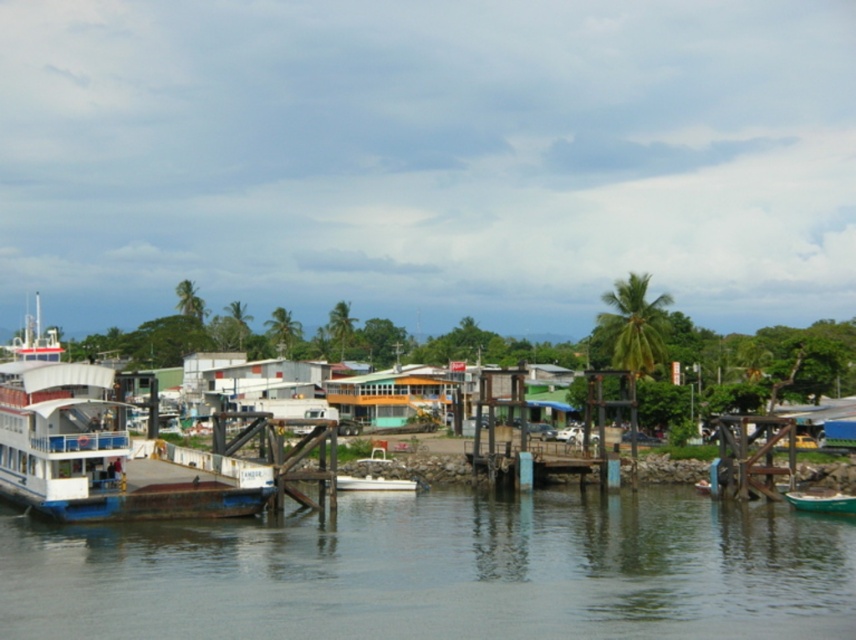
From the picture: You are standing at the point marked by the coordinates point (x=100, y=448) in the image. What object are you directly facing?

You are directly facing the white matte boat at left because the coordinates point (x=100, y=448) indicate its location.

You are a tourist standing on the wooden dock and want to take a photo of the white matte boat at left and the green water at lower center. Based on their positions, which object should you frame first in your camera viewfinder to ensure both are in the shot?

The white matte boat at left should be framed first since it is positioned to the left of the green water at lower center, which is to its right. By starting with the boat on the left, you can adjust the viewfinder to include the water to its right in the frame.